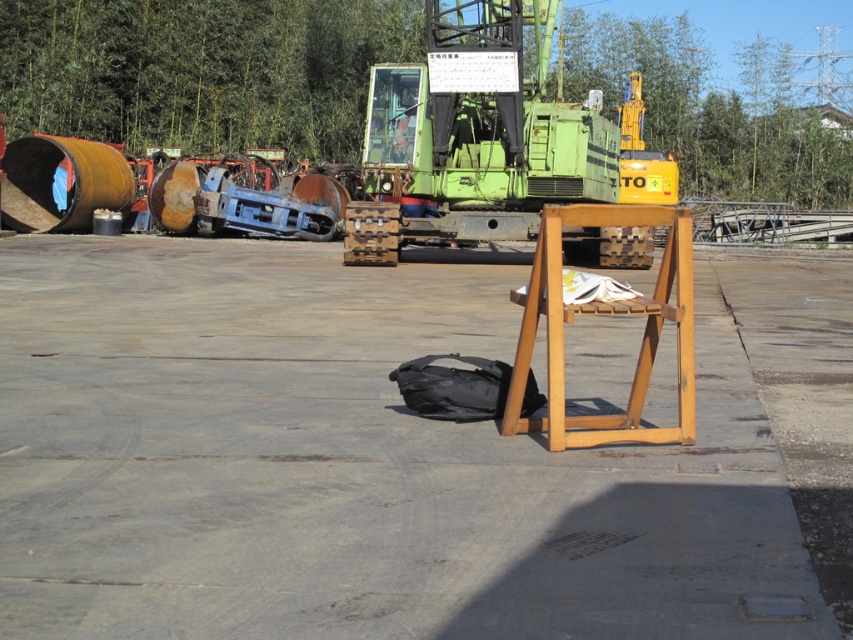
Describe the element at coordinates (351, 461) in the screenshot. This screenshot has width=853, height=640. I see `wooden table at center` at that location.

Can you confirm if wooden table at center is positioned to the right of green matte forklift at center?

Incorrect, wooden table at center is not on the right side of green matte forklift at center.

Is point (764, 294) farther from camera compared to point (413, 148)?

No, it is in front of (413, 148).

You are a GUI agent. You are given a task and a screenshot of the screen. Output one action in this format:
    pyautogui.click(x=<x>, y=<y>)
    Task: Click on the wooden table at center
    This screenshot has width=853, height=640.
    Given the screenshot: What is the action you would take?
    pyautogui.click(x=351, y=461)

Can you confirm if wooden table at center is positioned below rusty metal barrel at left?

Correct, wooden table at center is located below rusty metal barrel at left.

Does wooden table at center appear on the left side of rusty metal barrel at left?

In fact, wooden table at center is to the right of rusty metal barrel at left.

The width and height of the screenshot is (853, 640). Find the location of `wooden table at center`. wooden table at center is located at coordinates (351, 461).

Who is positioned more to the right, green matte forklift at center or rusty metal barrel at left?

green matte forklift at center is more to the right.

Who is more forward, (540,138) or (32,170)?

Point (540,138) is in front.

Does point (548, 8) come farther from viewer compared to point (96, 204)?

That is False.

Image resolution: width=853 pixels, height=640 pixels. I want to click on green matte forklift at center, so click(485, 141).